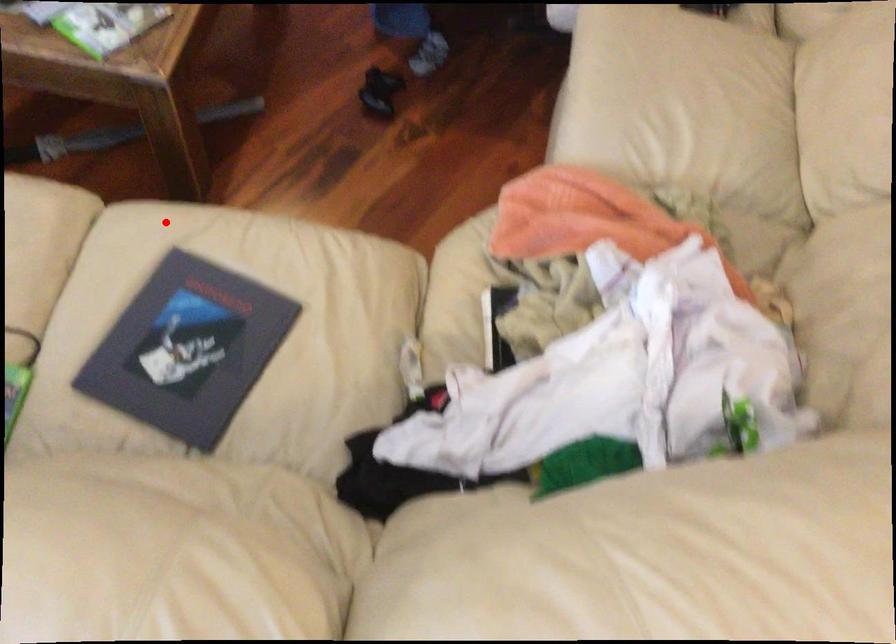
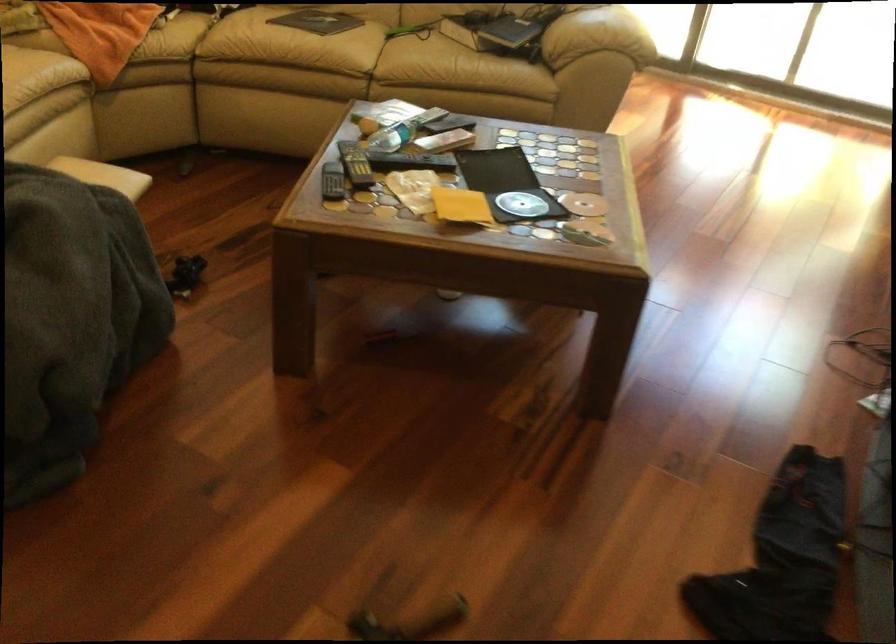
Find the pixel in the second image that matches the highlighted location in the first image.

(334, 58)